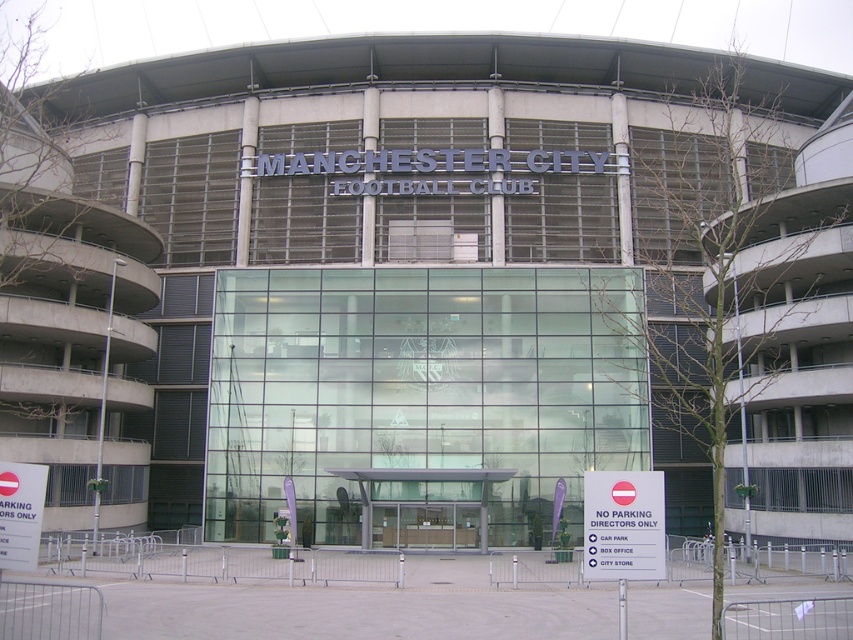
Question: Is white plastic sign at lower right below white plastic sign at lower left?

Choices:
 (A) no
 (B) yes

Answer: (B)

Question: Among these points, which one is farthest from the camera?

Choices:
 (A) (601, 525)
 (B) (20, 564)

Answer: (B)

Question: Does white plastic sign at lower right appear on the left side of white plastic sign at lower left?

Choices:
 (A) no
 (B) yes

Answer: (A)

Question: Which point is farther to the camera?

Choices:
 (A) (631, 572)
 (B) (0, 568)

Answer: (B)

Question: Where is white plastic sign at lower right located in relation to white plastic sign at lower left in the image?

Choices:
 (A) below
 (B) above

Answer: (A)